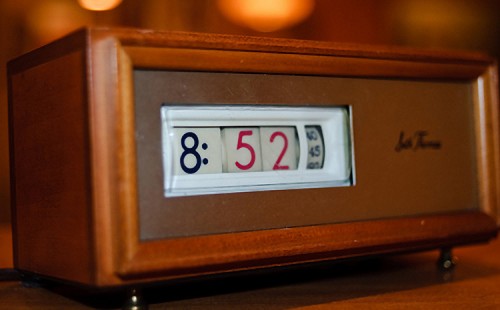
Where is `alarm clock`? The width and height of the screenshot is (500, 310). alarm clock is located at coordinates (384, 119).